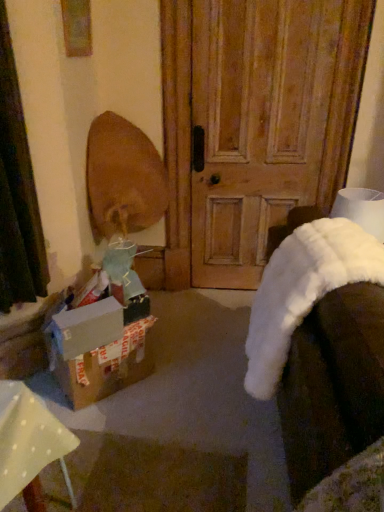
This screenshot has height=512, width=384. I want to click on wooden door at center, so click(254, 126).

This screenshot has width=384, height=512. What are the coordinates of `cardboard box at lower left` in the screenshot? It's located at (87, 327).

From a real-world perspective, is white fluffy blanket at lower right above or below cardboard box at lower left?

white fluffy blanket at lower right is situated higher than cardboard box at lower left in the real world.

Considering the relative sizes of white fluffy blanket at lower right and cardboard box at lower left in the image provided, is white fluffy blanket at lower right shorter than cardboard box at lower left?

In fact, white fluffy blanket at lower right may be taller than cardboard box at lower left.

Considering the relative sizes of white fluffy blanket at lower right and cardboard box at lower left in the image provided, is white fluffy blanket at lower right wider than cardboard box at lower left?

Indeed, white fluffy blanket at lower right has a greater width compared to cardboard box at lower left.

Can we say white fluffy blanket at lower right lies outside cardboard box at lower left?

Yes, white fluffy blanket at lower right is located beyond the bounds of cardboard box at lower left.

Considering the relative sizes of cardboard box at lower left and wooden door at center in the image provided, is cardboard box at lower left shorter than wooden door at center?

Yes.

Considering the relative positions of cardboard box at lower left and wooden door at center in the image provided, is cardboard box at lower left to the right of wooden door at center from the viewer's perspective?

No.

Looking at the image, does cardboard box at lower left seem bigger or smaller compared to wooden door at center?

Considering their sizes, cardboard box at lower left takes up less space than wooden door at center.

From a real-world perspective, is cardboard box at lower left over wooden door at center?

No.

Considering the sizes of brown cardboard box at lower left and white fluffy blanket at lower right in the image, is brown cardboard box at lower left wider or thinner than white fluffy blanket at lower right?

brown cardboard box at lower left is thinner than white fluffy blanket at lower right.

Locate an element on the screen. The width and height of the screenshot is (384, 512). box located below the white fluffy blanket at lower right (from the image's perspective) is located at coordinates (104, 365).

Is brown cardboard box at lower left taller than white fluffy blanket at lower right?

In fact, brown cardboard box at lower left may be shorter than white fluffy blanket at lower right.

How much distance is there between brown cardboard box at lower left and white fluffy blanket at lower right?

The distance of brown cardboard box at lower left from white fluffy blanket at lower right is 35.28 inches.

From a real-world perspective, who is located higher, wooden door at center or brown cardboard box at lower left?

wooden door at center.

Is point (206, 203) positioned in front of point (94, 379)?

No.

Considering the sizes of wooden door at center and brown cardboard box at lower left in the image, is wooden door at center wider or thinner than brown cardboard box at lower left?

Considering their sizes, wooden door at center looks slimmer than brown cardboard box at lower left.

Is wooden door at center touching brown cardboard box at lower left?

wooden door at center is not next to brown cardboard box at lower left, and they're not touching.

Is white fluffy blanket at lower right oriented away from wooden door at center?

No, white fluffy blanket at lower right is not facing away from wooden door at center.

Which object is closer to the camera taking this photo, white fluffy blanket at lower right or wooden door at center?

white fluffy blanket at lower right is more forward.

You are a GUI agent. You are given a task and a screenshot of the screen. Output one action in this format:
    pyautogui.click(x=<x>, y=<y>)
    Task: Click on the door positioned vertically above the white fluffy blanket at lower right (from a real-world perspective)
    
    Given the screenshot: What is the action you would take?
    pyautogui.click(x=254, y=126)

Considering the points (88, 387) and (88, 318), which point is behind, point (88, 387) or point (88, 318)?

The point (88, 387) is farther from the camera.

Between brown cardboard box at lower left and cardboard box at lower left, which one appears on the left side from the viewer's perspective?

From the viewer's perspective, cardboard box at lower left appears more on the left side.

Locate an element on the screen. Image resolution: width=384 pixels, height=512 pixels. cardboard box that is above the brown cardboard box at lower left (from the image's perspective) is located at coordinates pos(87,327).

Is brown cardboard box at lower left positioned far away from cardboard box at lower left?

brown cardboard box at lower left is near cardboard box at lower left, not far away.

From the image's perspective, which is below, white fluffy blanket at lower right or brown cardboard box at lower left?

brown cardboard box at lower left is shown below in the image.

Does white fluffy blanket at lower right turn towards brown cardboard box at lower left?

No, white fluffy blanket at lower right is not oriented towards brown cardboard box at lower left.

Looking at this image, visually, is white fluffy blanket at lower right positioned to the left or to the right of brown cardboard box at lower left?

In the image, white fluffy blanket at lower right appears on the right side of brown cardboard box at lower left.

Considering the sizes of objects white fluffy blanket at lower right and brown cardboard box at lower left in the image provided, who is wider, white fluffy blanket at lower right or brown cardboard box at lower left?

white fluffy blanket at lower right is wider.

Where is `blanket above the cardboard box at lower left (from a real-world perspective)`? The height and width of the screenshot is (512, 384). blanket above the cardboard box at lower left (from a real-world perspective) is located at coordinates (303, 290).

Where is `cardboard box below the wooden door at center (from a real-world perspective)`? This screenshot has width=384, height=512. cardboard box below the wooden door at center (from a real-world perspective) is located at coordinates (87, 327).

From the picture: Estimate the real-world distances between objects in this image. Which object is further from white fluffy blanket at lower right, cardboard box at lower left or wooden door at center?

wooden door at center is positioned further to the anchor white fluffy blanket at lower right.

Estimate the real-world distances between objects in this image. Which object is further from cardboard box at lower left, white fluffy blanket at lower right or wooden door at center?

Among the two, wooden door at center is located further to cardboard box at lower left.

Based on their spatial positions, is brown cardboard box at lower left or wooden door at center further from white fluffy blanket at lower right?

wooden door at center.

Which object lies further to the anchor point wooden door at center, brown cardboard box at lower left or cardboard box at lower left?

cardboard box at lower left.

Considering their positions, is wooden door at center positioned further to white fluffy blanket at lower right than brown cardboard box at lower left?

Among the two, wooden door at center is located further to white fluffy blanket at lower right.

Looking at the image, which one is located further to cardboard box at lower left, wooden door at center or white fluffy blanket at lower right?

wooden door at center.

Which object lies further to the anchor point brown cardboard box at lower left, white fluffy blanket at lower right or cardboard box at lower left?

white fluffy blanket at lower right is further to brown cardboard box at lower left.

Considering their positions, is wooden door at center positioned closer to brown cardboard box at lower left than cardboard box at lower left?

cardboard box at lower left is positioned closer to the anchor brown cardboard box at lower left.

Locate an element on the screen. This screenshot has height=512, width=384. box situated between cardboard box at lower left and white fluffy blanket at lower right from left to right is located at coordinates (104, 365).

Find the location of a particular element. This screenshot has width=384, height=512. door between cardboard box at lower left and white fluffy blanket at lower right in the horizontal direction is located at coordinates (254, 126).

This screenshot has width=384, height=512. Find the location of `door between brown cardboard box at lower left and white fluffy blanket at lower right from left to right`. door between brown cardboard box at lower left and white fluffy blanket at lower right from left to right is located at coordinates (254, 126).

Where is `cardboard box between wooden door at center and brown cardboard box at lower left vertically`? cardboard box between wooden door at center and brown cardboard box at lower left vertically is located at coordinates (87, 327).